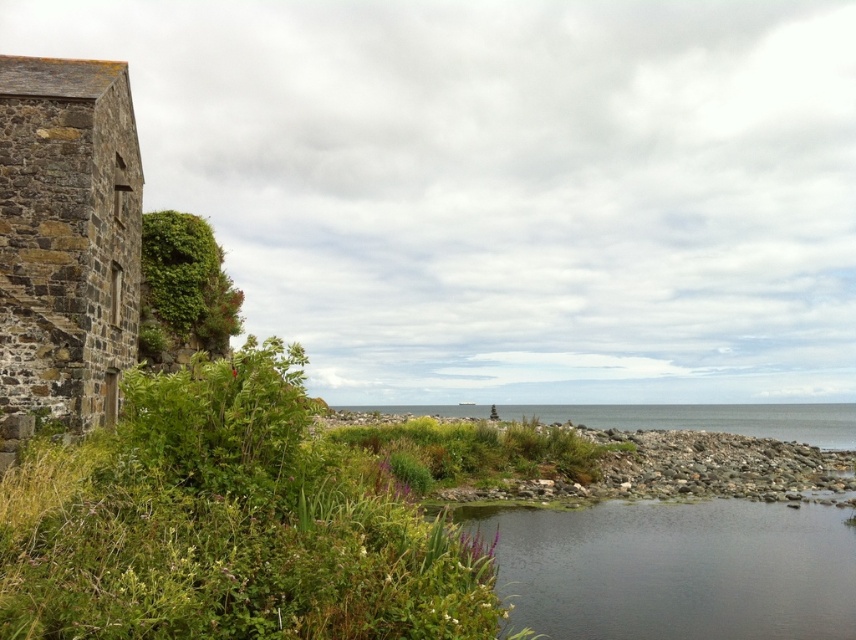
You are standing at the origin point of the image coordinate system. You want to walk to the clear water at lower center. What are the coordinates you need to move to?

The coordinates for the clear water at lower center are at point (675,570). So you need to move to those coordinates to reach it.

You are standing at the edge of the coastal scene and notice two areas of clear water. The first is labeled as clear water at lower center and the second as clear water at center. Which of these two water areas is located higher up in the image?

The clear water at lower center is positioned over the clear water at center, meaning it is higher up in the image.

You are a kayaker approaching the coast and see two areas of clear water. The first is labeled as clear water at lower center and the second as clear water at center. Which area of clear water is larger?

The clear water at center is larger than the clear water at lower center.